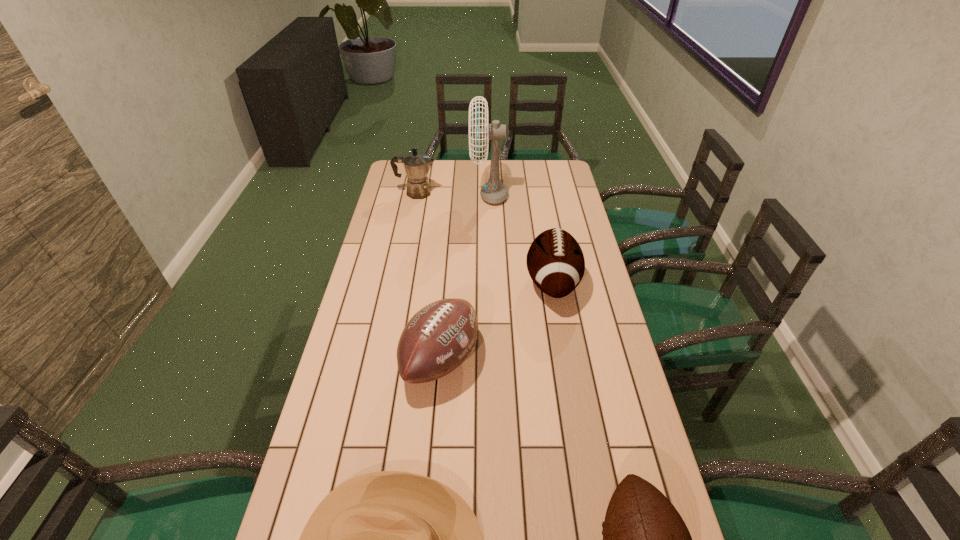
Select which football is the closest to the fourth farthest object. Please provide its 2D coordinates. Your answer should be formatted as a tuple, i.e. [(x, y)], where the tuple contains the x and y coordinates of a point satisfying the conditions above.

[(555, 261)]

Find the location of a particular element. vacant space that satisfies the following two spatial constraints: 1. on the back side of the third farthest object; 2. on the pouring side of the coffeepot is located at coordinates (537, 193).

Identify the location of free spot that satisfies the following two spatial constraints: 1. on the pouring side of the coffeepot; 2. on the right side of the third nearest object. (383, 360).

You are a GUI agent. You are given a task and a screenshot of the screen. Output one action in this format:
    pyautogui.click(x=<x>, y=<y>)
    Task: Click on the free space that satisfies the following two spatial constraints: 1. on the front-facing side of the fan; 2. on the right side of the third farthest object
    
    Given the screenshot: What is the action you would take?
    pyautogui.click(x=492, y=283)

Identify the location of vacant region that satisfies the following two spatial constraints: 1. on the front-facing side of the fourth nearest object; 2. on the right side of the tallest object. This screenshot has height=540, width=960. (492, 283).